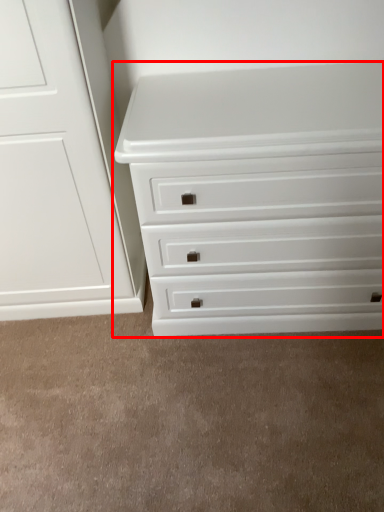
Question: In this image, where is chest of drawers (annotated by the red box) located relative to plain?

Choices:
 (A) right
 (B) left

Answer: (A)